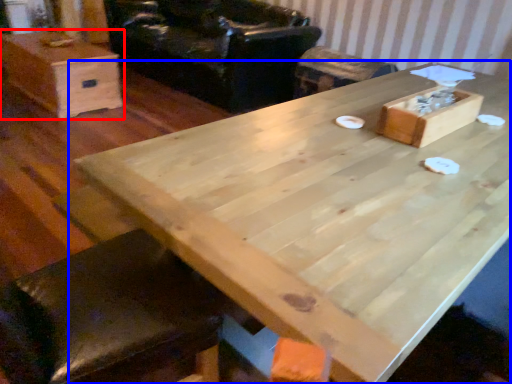
Question: Among these objects, which one is nearest to the camera, box (highlighted by a red box) or table (highlighted by a blue box)?

Choices:
 (A) box
 (B) table

Answer: (B)